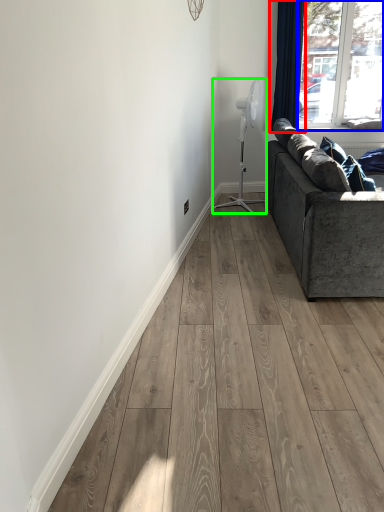
Question: Which object is positioned closest to curtain (highlighted by a red box)? Select from window (highlighted by a blue box) and fan (highlighted by a green box).

Choices:
 (A) window
 (B) fan

Answer: (B)